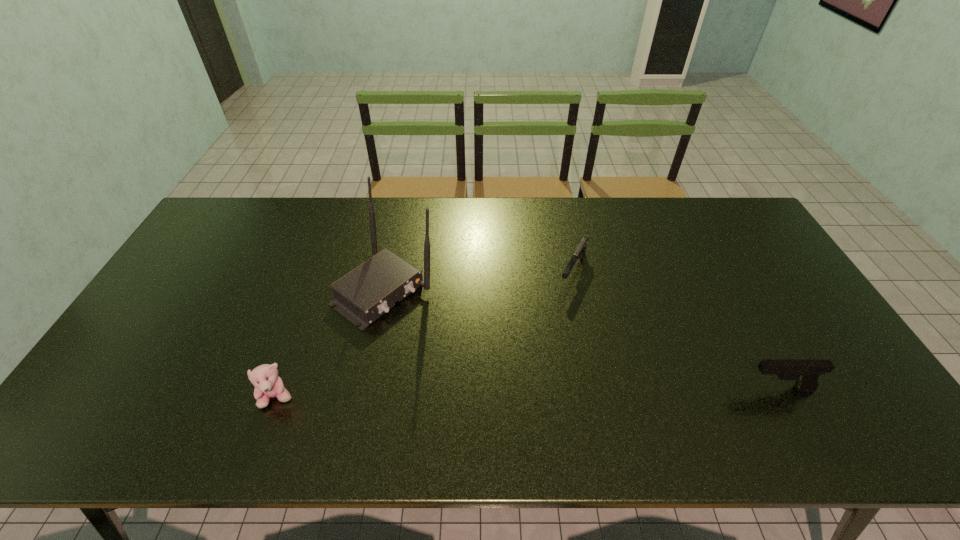
Locate an element on the screen. teddy bear is located at coordinates (268, 384).

The image size is (960, 540). I want to click on pistol, so click(806, 372).

The image size is (960, 540). Identify the location of router. (364, 294).

At what (x,y) coordinates should I click in order to perform the action: click on the tallest object. Please return your answer as a coordinate pair (x, y). This screenshot has width=960, height=540. Looking at the image, I should click on (364, 294).

You are a GUI agent. You are given a task and a screenshot of the screen. Output one action in this format:
    pyautogui.click(x=<x>, y=<y>)
    Task: Click on the shortest object
    The height and width of the screenshot is (540, 960).
    Given the screenshot: What is the action you would take?
    pyautogui.click(x=581, y=249)

Where is `gun`? gun is located at coordinates (581, 249).

Where is `vacant space situated on the front-facing side of the rightmost object`? The width and height of the screenshot is (960, 540). vacant space situated on the front-facing side of the rightmost object is located at coordinates (625, 389).

Where is `free point located on the front-facing side of the rightmost object`? This screenshot has height=540, width=960. free point located on the front-facing side of the rightmost object is located at coordinates [617, 389].

The height and width of the screenshot is (540, 960). Identify the location of vacant area situated on the front-facing side of the rightmost object. (601, 389).

Image resolution: width=960 pixels, height=540 pixels. Find the location of `vacant space situated 0.190m on the back of the tallest object to connect cables`. vacant space situated 0.190m on the back of the tallest object to connect cables is located at coordinates (471, 352).